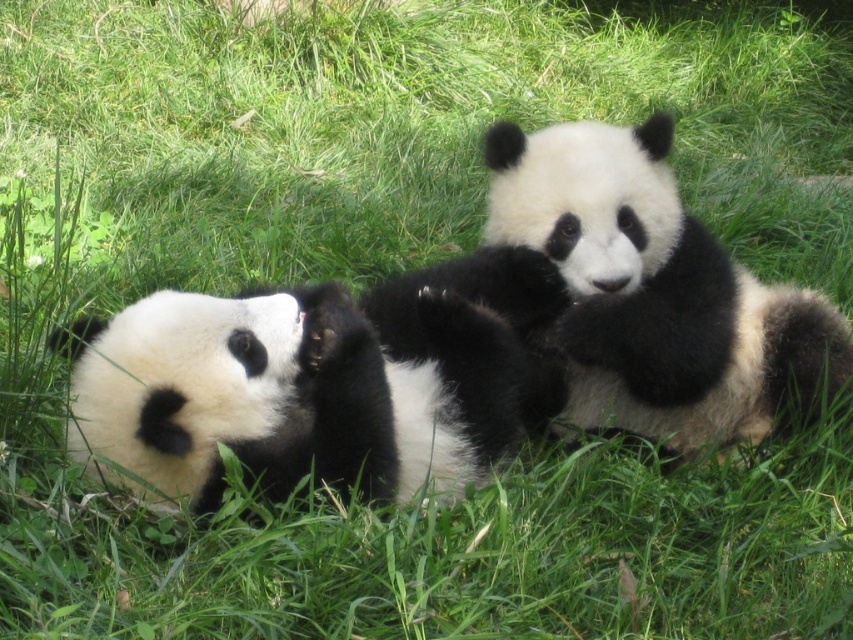
Between soft fur panda at center and soft fur panda at left, which one appears on the left side from the viewer's perspective?

From the viewer's perspective, soft fur panda at left appears more on the left side.

At what (x,y) coordinates should I click in order to perform the action: click on soft fur panda at center. Please return your answer as a coordinate pair (x, y). Looking at the image, I should click on tap(631, 296).

The width and height of the screenshot is (853, 640). Describe the element at coordinates (631, 296) in the screenshot. I see `soft fur panda at center` at that location.

You are a GUI agent. You are given a task and a screenshot of the screen. Output one action in this format:
    pyautogui.click(x=<x>, y=<y>)
    Task: Click on the soft fur panda at center
    
    Given the screenshot: What is the action you would take?
    pyautogui.click(x=631, y=296)